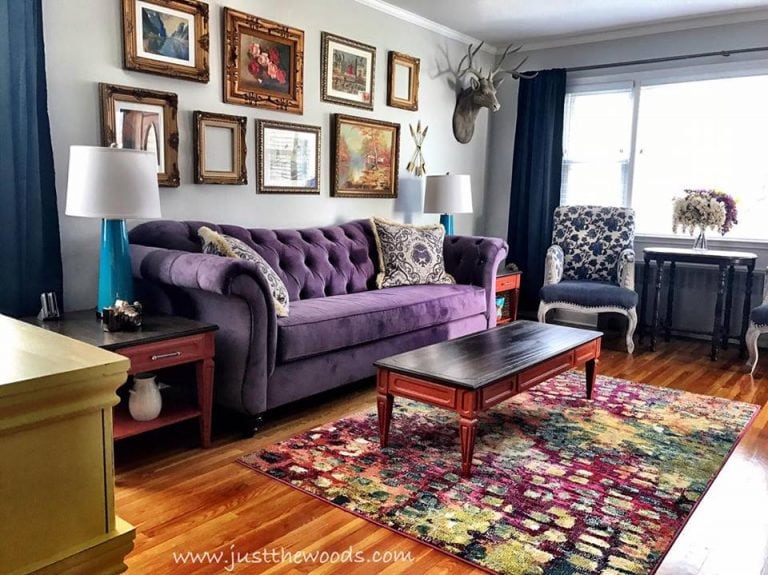
Where is `white chair legs`? The width and height of the screenshot is (768, 575). white chair legs is located at coordinates (750, 362), (629, 338), (541, 319).